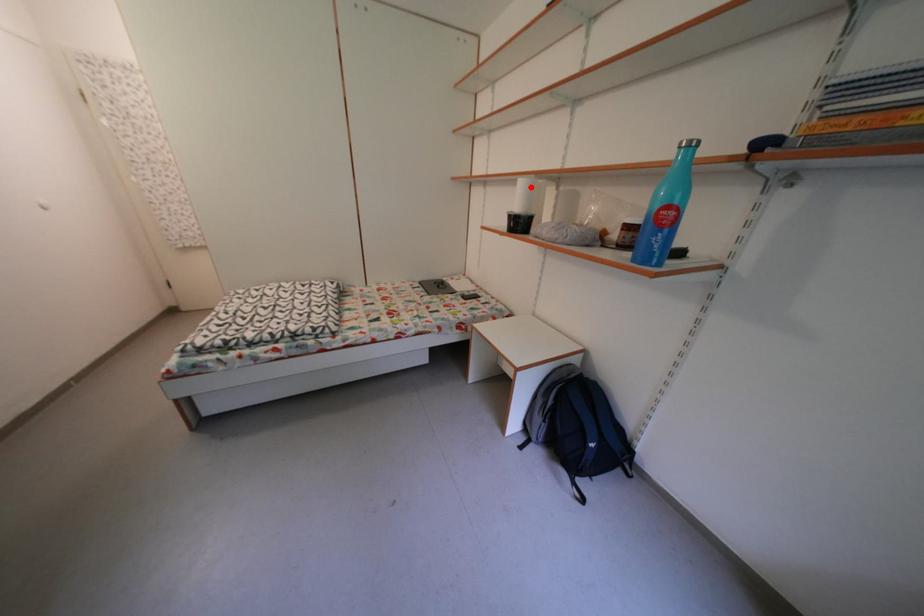
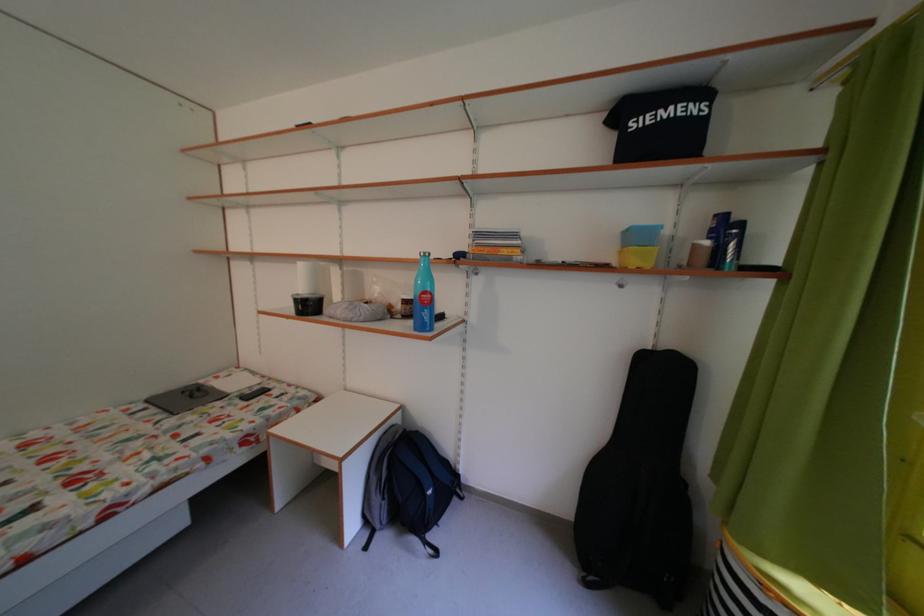
The point at the highlighted location is marked in the first image. Where is the corresponding point in the second image?

(311, 270)